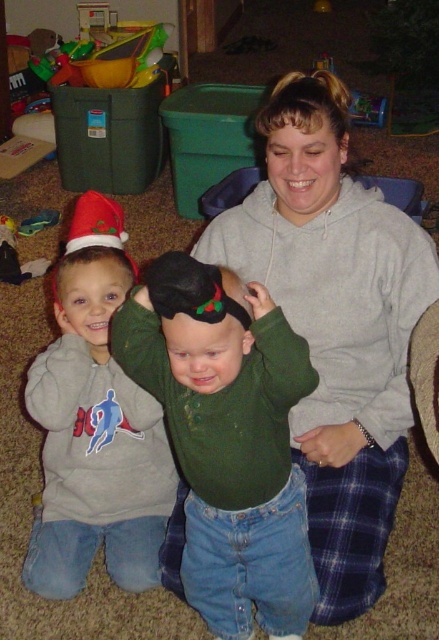
Question: Observing the image, what is the correct spatial positioning of green matte sweater at center in reference to matte gray hoodie at left?

Choices:
 (A) left
 (B) right

Answer: (B)

Question: In this image, where is matte green sweater at center located relative to matte gray hoodie at left?

Choices:
 (A) right
 (B) left

Answer: (A)

Question: Which of the following is the closest to the observer?

Choices:
 (A) green matte sweater at center
 (B) matte green sweater at center

Answer: (B)

Question: Considering the real-world distances, which object is closest to the green matte sweater at center?

Choices:
 (A) matte gray hoodie at left
 (B) matte green sweater at center

Answer: (B)

Question: Can you confirm if green matte sweater at center is wider than matte gray hoodie at left?

Choices:
 (A) yes
 (B) no

Answer: (A)

Question: Which is farther from the green matte sweater at center?

Choices:
 (A) matte green sweater at center
 (B) matte gray hoodie at left

Answer: (B)